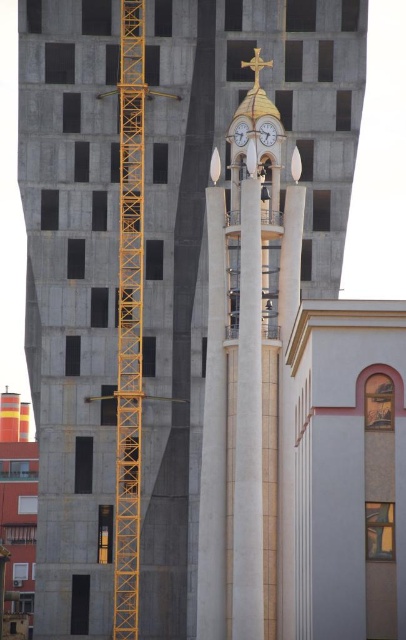
Is yellow metallic crane at left below metallic gold clock at upper center?

Yes.

Is point (138, 164) closer to camera compared to point (272, 138)?

That is False.

Does point (125, 538) lie in front of point (265, 141)?

No, (125, 538) is further to viewer.

You are a GUI agent. You are given a task and a screenshot of the screen. Output one action in this format:
    pyautogui.click(x=<x>, y=<y>)
    Task: Click on the yellow metallic crane at left
    The width and height of the screenshot is (406, 640).
    Given the screenshot: What is the action you would take?
    pyautogui.click(x=129, y=317)

Can you confirm if yellow metallic crane at left is thinner than white glossy clock at upper center?

Incorrect, yellow metallic crane at left's width is not less than white glossy clock at upper center's.

What do you see at coordinates (129, 317) in the screenshot? I see `yellow metallic crane at left` at bounding box center [129, 317].

Who is more distant from viewer, (131, 634) or (243, 129)?

The point (131, 634) is more distant.

You are a GUI agent. You are given a task and a screenshot of the screen. Output one action in this format:
    pyautogui.click(x=<x>, y=<y>)
    Task: Click on the yellow metallic crane at left
    
    Given the screenshot: What is the action you would take?
    pyautogui.click(x=129, y=317)

Is metallic gold clock at upper center behind white glossy clock at upper center?

No, metallic gold clock at upper center is closer to the viewer.

Is metallic gold clock at upper center to the left of white glossy clock at upper center from the viewer's perspective?

Incorrect, metallic gold clock at upper center is not on the left side of white glossy clock at upper center.

Is point (263, 129) in front of point (241, 141)?

Yes, it is in front of point (241, 141).

Where is `metallic gold clock at upper center`? metallic gold clock at upper center is located at coordinates (267, 132).